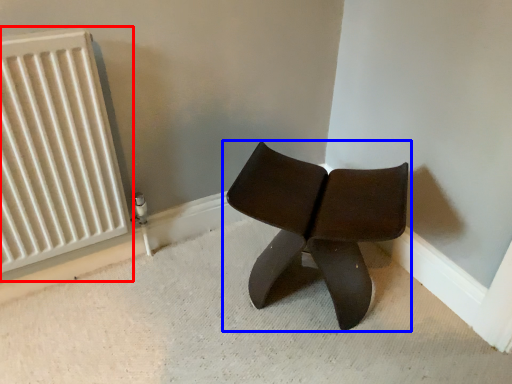
Question: Which point is further to the camera, radiator (highlighted by a red box) or chair (highlighted by a blue box)?

Choices:
 (A) radiator
 (B) chair

Answer: (B)